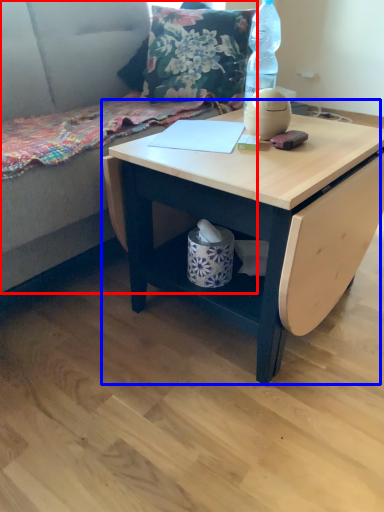
Question: Which of the following is the farthest to the observer, couch (highlighted by a red box) or table (highlighted by a blue box)?

Choices:
 (A) couch
 (B) table

Answer: (B)